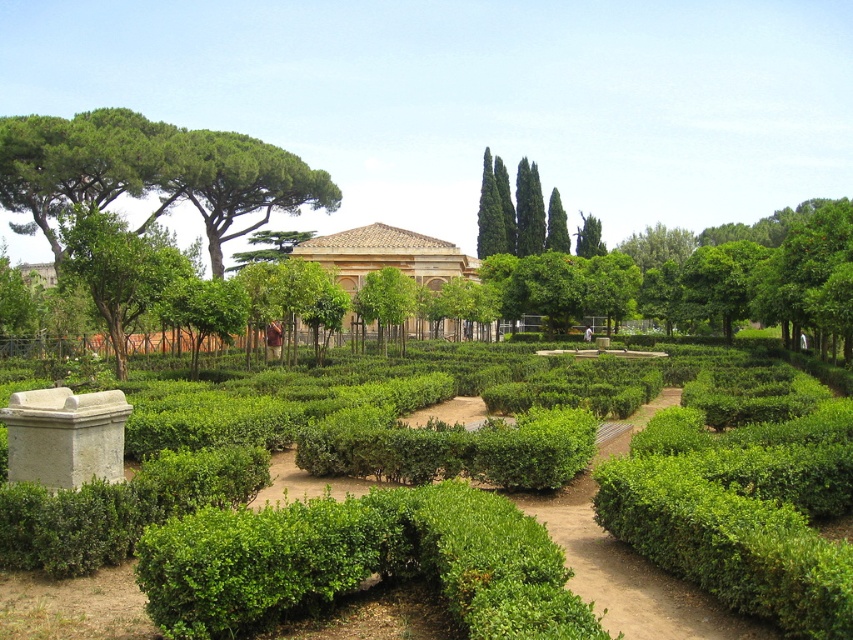
Based on the photo, between green leafy tree at upper left and green leafy tree at upper center, which one has more height?

With more height is green leafy tree at upper center.

Who is positioned more to the left, green leafy tree at upper left or green leafy tree at upper center?

Positioned to the left is green leafy tree at upper left.

In the scene shown: Measure the distance between point (273, 198) and camera.

Point (273, 198) is 88.80 meters away from camera.

At what (x,y) coordinates should I click in order to perform the action: click on green leafy tree at upper left. Please return your answer as a coordinate pair (x, y). Image resolution: width=853 pixels, height=640 pixels. Looking at the image, I should click on (236, 182).

Who is more forward, (444, 250) or (488, 188)?

Point (444, 250) is more forward.

Does brown stone building at center appear under green leafy tree at upper center?

Yes, brown stone building at center is below green leafy tree at upper center.

Where is `brown stone building at center`? The width and height of the screenshot is (853, 640). brown stone building at center is located at coordinates (387, 256).

Which is more to the left, green leafy tree at upper left or brown stone building at center?

green leafy tree at upper left

Between point (223, 156) and point (439, 284), which one is positioned in front?

Point (223, 156) is in front.

I want to click on green leafy tree at upper left, so click(236, 182).